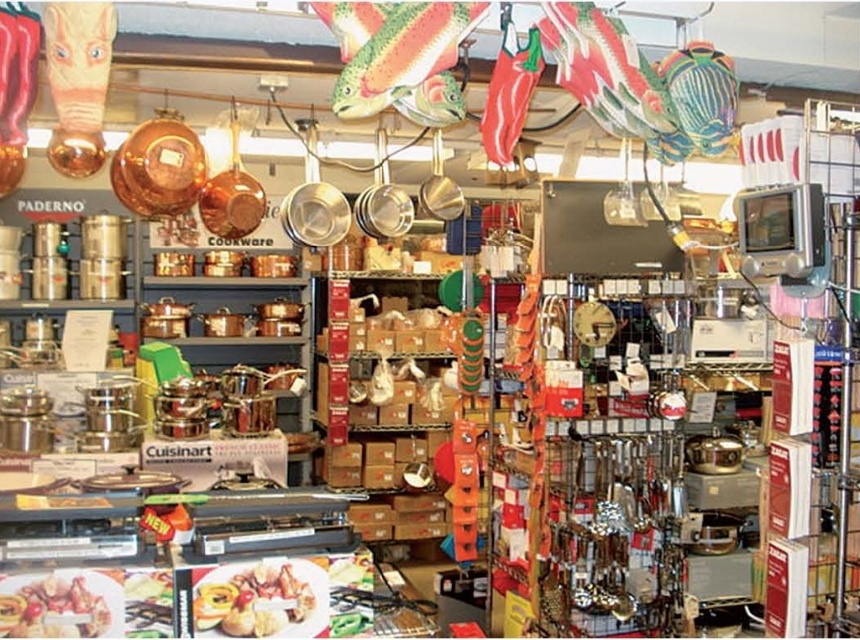
Question: Which point is closer to the camera?

Choices:
 (A) golden brown crispy chicken at center
 (B) golden brown bread at center

Answer: (A)

Question: Can you confirm if golden brown bread at center is positioned below golden brown crispy chicken at center?

Choices:
 (A) no
 (B) yes

Answer: (B)

Question: Is golden brown bread at center in front of golden brown crispy chicken at center?

Choices:
 (A) yes
 (B) no

Answer: (B)

Question: Which object is farther from the camera taking this photo?

Choices:
 (A) golden brown bread at center
 (B) golden brown crispy chicken at center

Answer: (A)

Question: Does golden brown bread at center appear on the right side of golden brown crispy chicken at center?

Choices:
 (A) yes
 (B) no

Answer: (A)